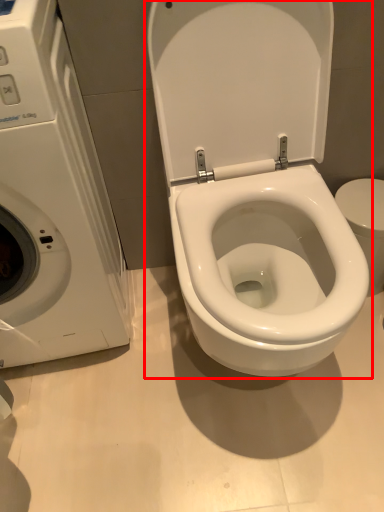
Question: From the image's perspective, considering the relative positions of toilet (annotated by the red box) and washing machine in the image provided, where is toilet (annotated by the red box) located with respect to the staircase?

Choices:
 (A) above
 (B) below

Answer: (A)